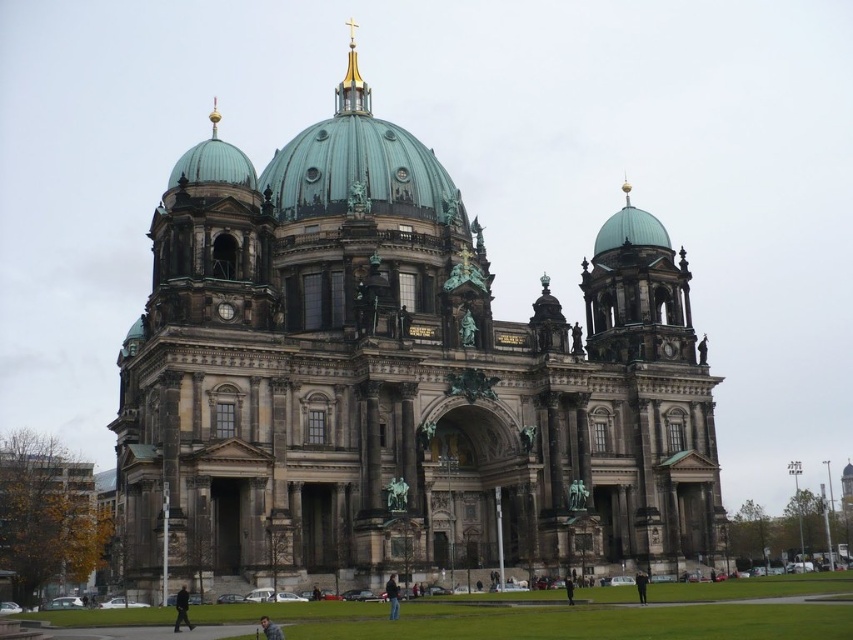
Question: Which of the following is the farthest from the observer?

Choices:
 (A) light brown leather jacket at center
 (B) dark gray stone church at center

Answer: (B)

Question: Among these objects, which one is nearest to the camera?

Choices:
 (A) dark blue jeans at center
 (B) dark gray jacket at lower center
 (C) light brown leather jacket at center

Answer: (C)

Question: Does dark gray stone church at center have a greater width compared to dark gray jacket at lower center?

Choices:
 (A) no
 (B) yes

Answer: (B)

Question: Which object appears closest to the camera in this image?

Choices:
 (A) dark gray jacket at lower center
 (B) dark gray stone church at center
 (C) gold plated spire at upper center
 (D) light brown leather jacket at center

Answer: (D)

Question: Is dark gray stone church at center positioned behind light brown leather jacket at center?

Choices:
 (A) yes
 (B) no

Answer: (A)

Question: Is dark gray stone church at center positioned in front of gold plated spire at upper center?

Choices:
 (A) no
 (B) yes

Answer: (B)